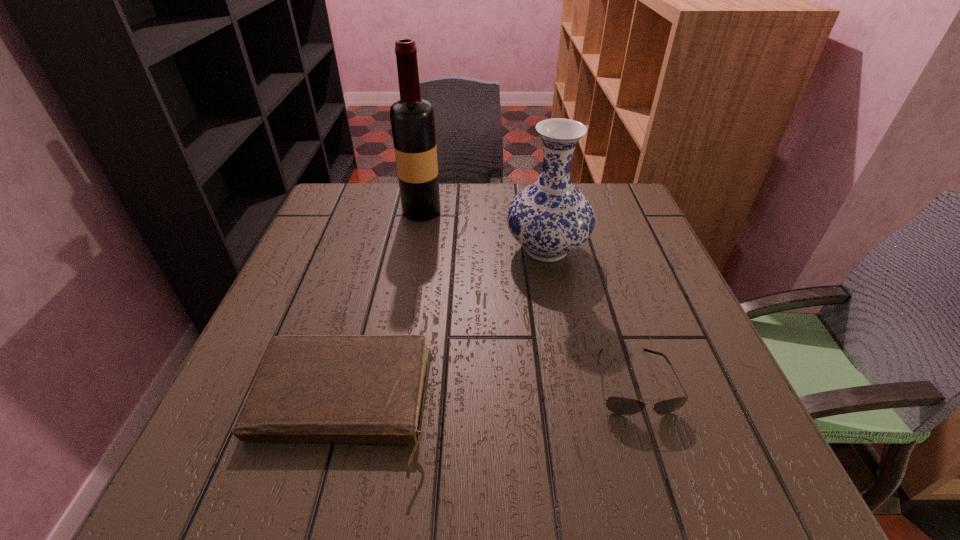
Identify the location of object that is at the near edge. (309, 388).

At what (x,y) coordinates should I click in order to perform the action: click on object that is at the left edge. Please return your answer as a coordinate pair (x, y). Looking at the image, I should click on (309, 388).

This screenshot has height=540, width=960. Find the location of `object that is at the right edge`. object that is at the right edge is located at coordinates (619, 405).

I want to click on object that is at the near left corner, so click(309, 388).

Where is `vacant space at the far edge of the desktop`? Image resolution: width=960 pixels, height=540 pixels. vacant space at the far edge of the desktop is located at coordinates (497, 228).

Find the location of `vacant space at the left edge of the desktop`. vacant space at the left edge of the desktop is located at coordinates (293, 292).

Find the location of a particular element. The width and height of the screenshot is (960, 540). vacant space at the right edge is located at coordinates (628, 252).

The image size is (960, 540). In the image, there is a desktop. In order to click on free space at the far left corner in this screenshot , I will do `click(366, 214)`.

Find the location of `free region at the far right corner`. free region at the far right corner is located at coordinates (613, 214).

The width and height of the screenshot is (960, 540). I want to click on vacant space at the near right corner of the desktop, so click(x=729, y=467).